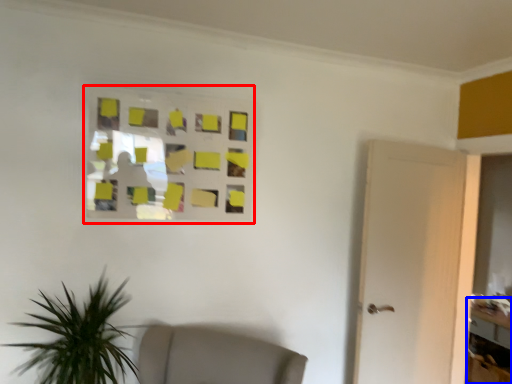
Question: Which point is closer to the camera, glass window (highlighted by a red box) or table (highlighted by a blue box)?

Choices:
 (A) glass window
 (B) table

Answer: (A)